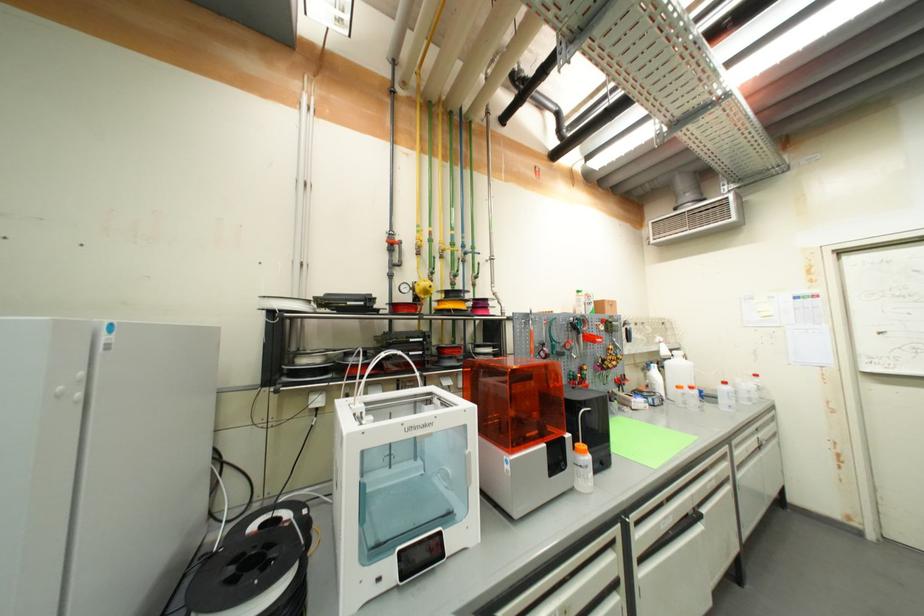
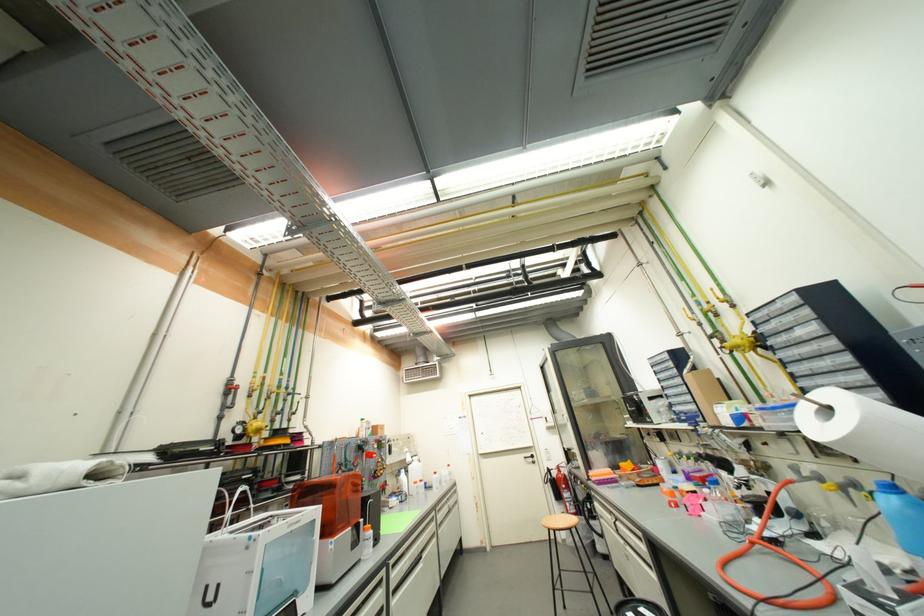
Where in the second image is the point corresponding to point 641,556 from the first image?

(396, 590)